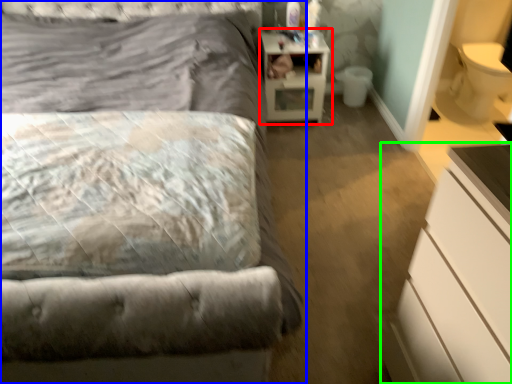
Question: Which is farther away from nightstand (highlighted by a red box)? bed (highlighted by a blue box) or chest of drawers (highlighted by a green box)?

Choices:
 (A) bed
 (B) chest of drawers

Answer: (B)